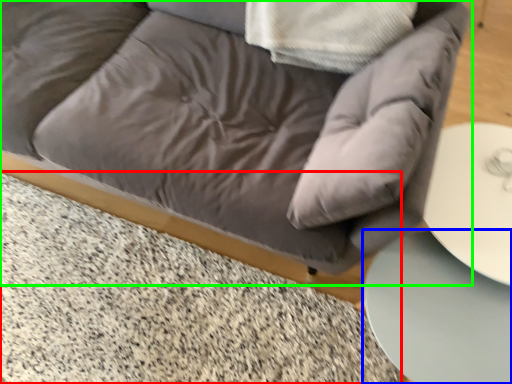
Question: Considering the real-world distances, which object is closest to marble (highlighted by a red box)? table (highlighted by a blue box) or studio couch (highlighted by a green box).

Choices:
 (A) table
 (B) studio couch

Answer: (B)